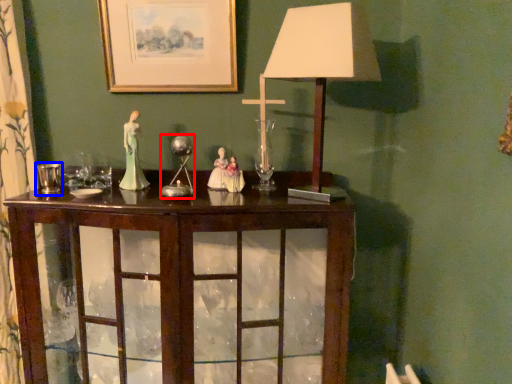
Question: Among these objects, which one is nearest to the camera, candle holder (highlighted by a red box) or candle holder (highlighted by a blue box)?

Choices:
 (A) candle holder
 (B) candle holder

Answer: (B)